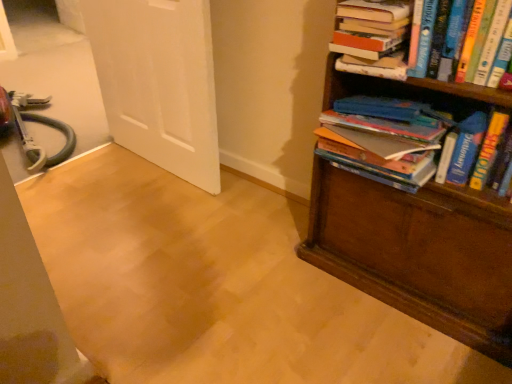
Question: Considering the relative sizes of white matte door at upper left and brown wooden bookcase at right in the image provided, is white matte door at upper left taller than brown wooden bookcase at right?

Choices:
 (A) no
 (B) yes

Answer: (A)

Question: Does white matte door at upper left turn towards brown wooden bookcase at right?

Choices:
 (A) yes
 (B) no

Answer: (B)

Question: Is white matte door at upper left wider than brown wooden bookcase at right?

Choices:
 (A) yes
 (B) no

Answer: (B)

Question: Is white matte door at upper left oriented away from brown wooden bookcase at right?

Choices:
 (A) yes
 (B) no

Answer: (B)

Question: Is brown wooden bookcase at right a part of white matte door at upper left?

Choices:
 (A) no
 (B) yes

Answer: (A)

Question: From the image's perspective, is brown wooden bookcase at right located above or below hardcover book at upper right, the first book viewed from the top?

Choices:
 (A) above
 (B) below

Answer: (B)

Question: Based on their positions, is brown wooden bookcase at right located to the left or right of hardcover book at upper right, positioned as the third book in bottom-to-top order?

Choices:
 (A) left
 (B) right

Answer: (B)

Question: Is point (349, 266) closer or farther from the camera than point (389, 34)?

Choices:
 (A) closer
 (B) farther

Answer: (B)

Question: Considering the positions of brown wooden bookcase at right and hardcover book at upper right, positioned as the third book in bottom-to-top order, in the image, is brown wooden bookcase at right bigger or smaller than hardcover book at upper right, positioned as the third book in bottom-to-top order,?

Choices:
 (A) small
 (B) big

Answer: (B)

Question: Is brown wooden bookcase at right taller or shorter than hardcover books at right, which is the 3th book in top-to-bottom order?

Choices:
 (A) short
 (B) tall

Answer: (B)

Question: Considering the positions of brown wooden bookcase at right and hardcover books at right, which is the 3th book in top-to-bottom order, in the image, is brown wooden bookcase at right bigger or smaller than hardcover books at right, which is the 3th book in top-to-bottom order,?

Choices:
 (A) small
 (B) big

Answer: (B)

Question: Visually, is brown wooden bookcase at right positioned to the left or to the right of hardcover books at right, which is the 3th book in top-to-bottom order?

Choices:
 (A) left
 (B) right

Answer: (B)

Question: Is brown wooden bookcase at right spatially inside hardcover books at right, the first book in the bottom-to-top sequence, or outside of it?

Choices:
 (A) inside
 (B) outside

Answer: (B)

Question: From a real-world perspective, is white matte door at upper left physically located above or below hardcover books at right, which is the 3th book in top-to-bottom order?

Choices:
 (A) above
 (B) below

Answer: (B)

Question: Visually, is white matte door at upper left positioned to the left or to the right of hardcover books at right, the first book in the bottom-to-top sequence?

Choices:
 (A) left
 (B) right

Answer: (A)